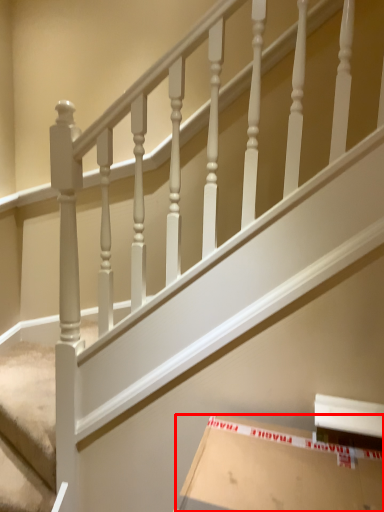
Question: From the image's perspective, considering the relative positions of cardboard box (annotated by the red box) and stairwell in the image provided, where is cardboard box (annotated by the red box) located with respect to the staircase?

Choices:
 (A) above
 (B) below

Answer: (B)